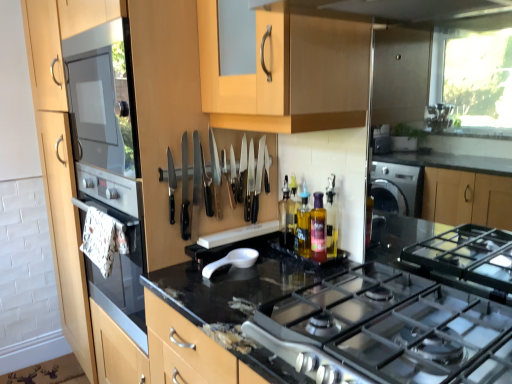
The image size is (512, 384). I want to click on free space to the left of translucent purple bottle at center, acting as the 2th bottle starting from the front, so click(271, 265).